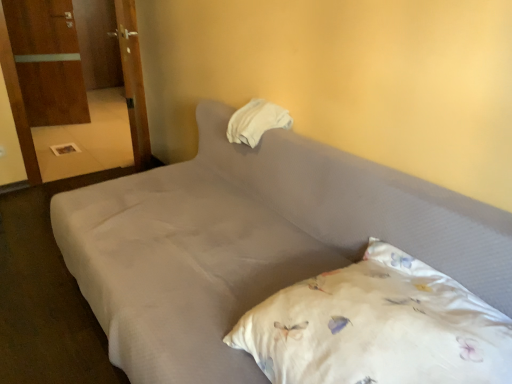
Identify the location of gray fabric bed at center. This screenshot has width=512, height=384. (252, 243).

What is the approximate width of wooden door at upper left?

wooden door at upper left is 6.95 inches wide.

This screenshot has width=512, height=384. In order to click on gray fabric bed at center in this screenshot , I will do `click(252, 243)`.

Is gray fabric bed at center taller or shorter than wooden door at left, arranged as the 1th armoire when viewed from the front?

Clearly, gray fabric bed at center is shorter compared to wooden door at left, arranged as the 1th armoire when viewed from the front.

Which is closer to the camera, [493,209] or [14,3]?

The point [493,209] is in front.

How many degrees apart are the facing directions of gray fabric bed at center and wooden door at left, arranged as the 1th armoire when viewed from the front?

The angular difference between gray fabric bed at center and wooden door at left, arranged as the 1th armoire when viewed from the front, is 89.3 degrees.

Locate an element on the screen. bed in front of the wooden door at left, arranged as the 1th armoire when viewed from the front is located at coordinates click(x=252, y=243).

Is white floral pillow at lower right, which appears as the 2th pillow when viewed from the back, thinner than gray fabric bed at center?

Yes.

The width and height of the screenshot is (512, 384). In order to click on the 1st pillow behind the gray fabric bed at center in this screenshot , I will do `click(377, 327)`.

Considering the positions of objects white floral pillow at lower right, the second pillow in the top-to-bottom sequence, and gray fabric bed at center in the image provided, who is behind, white floral pillow at lower right, the second pillow in the top-to-bottom sequence, or gray fabric bed at center?

white floral pillow at lower right, the second pillow in the top-to-bottom sequence, is more distant.

Relative to wooden door at left, the second armoire viewed from the back, is white floral pillow at lower right, which appears as the 2th pillow when viewed from the back, in front or behind?

white floral pillow at lower right, which appears as the 2th pillow when viewed from the back, is positioned closer to the viewer than wooden door at left, the second armoire viewed from the back.

Looking at the image, does white floral pillow at lower right, which appears as the 2th pillow when viewed from the back, seem bigger or smaller compared to wooden door at left, arranged as the 1th armoire when viewed from the front?

white floral pillow at lower right, which appears as the 2th pillow when viewed from the back, is smaller than wooden door at left, arranged as the 1th armoire when viewed from the front.

From the image's perspective, count 1st armoires upward from the white floral pillow at lower right, the second pillow in the top-to-bottom sequence, and point to it. Please provide its 2D coordinates.

[(133, 81)]

Is white floral pillow at lower right, marked as the 1th pillow in a front-to-back arrangement, not close to wooden door at left, marked as the first armoire in a right-to-left arrangement?

white floral pillow at lower right, marked as the 1th pillow in a front-to-back arrangement, is positioned a significant distance from wooden door at left, marked as the first armoire in a right-to-left arrangement.

Is point (29, 171) closer or farther from the camera than point (416, 305)?

Point (29, 171).

Looking at this image, considering the relative positions of wooden door at left, marked as the first armoire in a right-to-left arrangement, and white floral pillow at lower right, which appears as the 2th pillow when viewed from the back, in the image provided, is wooden door at left, marked as the first armoire in a right-to-left arrangement, to the left or to the right of white floral pillow at lower right, which appears as the 2th pillow when viewed from the back,?

Based on their positions, wooden door at left, marked as the first armoire in a right-to-left arrangement, is located to the left of white floral pillow at lower right, which appears as the 2th pillow when viewed from the back.

Consider the image. Which object is more forward, wooden door at left, marked as the first armoire in a right-to-left arrangement, or white floral pillow at lower right, the second pillow in the top-to-bottom sequence?

white floral pillow at lower right, the second pillow in the top-to-bottom sequence, is more forward.

From the picture: Could you tell me if wooden door at left, the second armoire viewed from the back, is facing white floral pillow at lower right, the second pillow in the top-to-bottom sequence?

Yes, wooden door at left, the second armoire viewed from the back, is oriented towards white floral pillow at lower right, the second pillow in the top-to-bottom sequence.

Is white floral pillow at lower right, acting as the 1th pillow starting from the bottom, in front of or behind wooden door at upper left in the image?

In the image, white floral pillow at lower right, acting as the 1th pillow starting from the bottom, appears in front of wooden door at upper left.

You are a GUI agent. You are given a task and a screenshot of the screen. Output one action in this format:
    pyautogui.click(x=<x>, y=<y>)
    Task: Click on the door above the white floral pillow at lower right, marked as the 1th pillow in a front-to-back arrangement (from a real-world perspective)
    This screenshot has height=384, width=512.
    Given the screenshot: What is the action you would take?
    pyautogui.click(x=133, y=81)

From the image's perspective, is white floral pillow at lower right, the second pillow in the top-to-bottom sequence, located beneath wooden door at upper left?

Correct, white floral pillow at lower right, the second pillow in the top-to-bottom sequence, appears lower than wooden door at upper left in the image.

Based on the photo, how far apart are white floral pillow at lower right, the second pillow in the top-to-bottom sequence, and wooden door at upper left?

A distance of 6.34 feet exists between white floral pillow at lower right, the second pillow in the top-to-bottom sequence, and wooden door at upper left.

Does wooden door at upper left have a lesser width compared to wooden door at left, arranged as the 1th armoire when viewed from the front?

No, wooden door at upper left is not thinner than wooden door at left, arranged as the 1th armoire when viewed from the front.

Considering the positions of points (132, 81) and (131, 82), is point (132, 81) farther from camera compared to point (131, 82)?

No, (132, 81) is closer to viewer.

From a real-world perspective, relative to wooden door at left, arranged as the 1th armoire when viewed from the front, is wooden door at upper left vertically above or below?

wooden door at upper left is above wooden door at left, arranged as the 1th armoire when viewed from the front.

Find the location of a particular element. Image resolution: width=512 pixels, height=384 pixels. bed on the right of wooden door at upper left is located at coordinates pos(252,243).

From the picture: From their relative heights in the image, would you say wooden door at upper left is taller or shorter than gray fabric bed at center?

Clearly, wooden door at upper left is taller compared to gray fabric bed at center.

Would you say wooden door at upper left is to the left or to the right of gray fabric bed at center in the picture?

From the image, it's evident that wooden door at upper left is to the left of gray fabric bed at center.

Where is `bed in front of the wooden door at left, marked as the first armoire in a right-to-left arrangement`? The image size is (512, 384). bed in front of the wooden door at left, marked as the first armoire in a right-to-left arrangement is located at coordinates (252, 243).

Identify the location of bed below the white floral pillow at lower right, which appears as the 2th pillow when viewed from the back (from a real-world perspective). This screenshot has width=512, height=384. (252, 243).

From the picture: Based on their spatial positions, is gray fabric bed at center or white fabric pillow at upper center, acting as the 1th pillow starting from the back, further from wooden door at upper left?

The object further to wooden door at upper left is gray fabric bed at center.

Consider the image. When comparing their distances from wooden door at upper left, does wooden armoire at left, the second armoire positioned from the front, or gray fabric bed at center seem closer?

gray fabric bed at center lies closer to wooden door at upper left than the other object.

Consider the image. When comparing their distances from gray fabric bed at center, does wooden door at upper left or wooden armoire at left, the second armoire positioned from the front, seem further?

Based on the image, wooden armoire at left, the second armoire positioned from the front, appears to be further to gray fabric bed at center.

Based on their spatial positions, is wooden door at upper left or white fabric pillow at upper center, which appears as the second pillow when ordered from the bottom, closer to wooden armoire at left, placed as the 1th armoire when sorted from back to front?

wooden door at upper left lies closer to wooden armoire at left, placed as the 1th armoire when sorted from back to front, than the other object.

When comparing their distances from wooden armoire at left, which is the 1th armoire from left to right, does gray fabric bed at center or wooden door at left, marked as the first armoire in a right-to-left arrangement, seem closer?

wooden door at left, marked as the first armoire in a right-to-left arrangement, is positioned closer to the anchor wooden armoire at left, which is the 1th armoire from left to right.

From the image, which object appears to be nearer to white floral pillow at lower right, the second pillow in the top-to-bottom sequence, wooden door at left, the second armoire viewed from the back, or wooden door at upper left?

wooden door at upper left is positioned closer to the anchor white floral pillow at lower right, the second pillow in the top-to-bottom sequence.

Looking at the image, which one is located further to white floral pillow at lower right, marked as the 1th pillow in a front-to-back arrangement, white fabric pillow at upper center, marked as the 1th pillow in a top-to-bottom arrangement, or wooden door at upper left?

Among the two, wooden door at upper left is located further to white floral pillow at lower right, marked as the 1th pillow in a front-to-back arrangement.

When comparing their distances from wooden door at left, the second armoire viewed from the back, does white floral pillow at lower right, acting as the 1th pillow starting from the bottom, or gray fabric bed at center seem further?

white floral pillow at lower right, acting as the 1th pillow starting from the bottom, is further to wooden door at left, the second armoire viewed from the back.

At what (x,y) coordinates should I click in order to perform the action: click on door situated between wooden door at left, marked as the first armoire in a right-to-left arrangement, and white fabric pillow at upper center, the second pillow from the front, from left to right. Please return your answer as a coordinate pair (x, y). This screenshot has height=384, width=512. Looking at the image, I should click on (133, 81).

Locate an element on the screen. This screenshot has height=384, width=512. armoire located between gray fabric bed at center and wooden armoire at left, placed as the 1th armoire when sorted from back to front, in the depth direction is located at coordinates (133, 81).

I want to click on pillow between white floral pillow at lower right, marked as the 1th pillow in a front-to-back arrangement, and wooden armoire at left, which is the 1th armoire from left to right, from front to back, so click(x=256, y=122).

This screenshot has height=384, width=512. What are the coordinates of `armoire between white fabric pillow at upper center, which appears as the second pillow when ordered from the bottom, and wooden armoire at left, the second armoire positioned from the front, along the z-axis` in the screenshot? It's located at (133, 81).